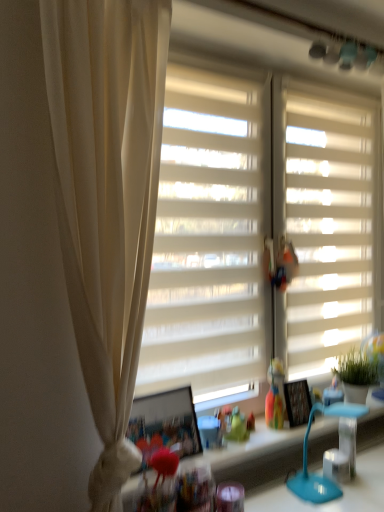
Question: From the image's perspective, is white matte window screen at center beneath translucent plastic toy at center?

Choices:
 (A) yes
 (B) no

Answer: (B)

Question: Can you confirm if white matte window screen at center is taller than translucent plastic toy at center?

Choices:
 (A) yes
 (B) no

Answer: (A)

Question: Is white matte window screen at center to the right of translucent plastic toy at center from the viewer's perspective?

Choices:
 (A) no
 (B) yes

Answer: (A)

Question: Can you confirm if white matte window screen at center is positioned to the left of translucent plastic toy at center?

Choices:
 (A) yes
 (B) no

Answer: (A)

Question: Is white matte window screen at center facing towards translucent plastic toy at center?

Choices:
 (A) yes
 (B) no

Answer: (A)

Question: From the image's perspective, is matte blue table lamp at lower right positioned above or below white matte window blind at right?

Choices:
 (A) above
 (B) below

Answer: (B)

Question: Considering the positions of point (306, 498) and point (362, 211), is point (306, 498) closer or farther from the camera than point (362, 211)?

Choices:
 (A) closer
 (B) farther

Answer: (A)

Question: In terms of size, does matte blue table lamp at lower right appear bigger or smaller than white matte window blind at right?

Choices:
 (A) small
 (B) big

Answer: (A)

Question: In the image, is matte blue table lamp at lower right positioned in front of or behind white matte window blind at right?

Choices:
 (A) front
 (B) behind

Answer: (A)

Question: In the image, is white matte window blind at right positioned in front of or behind matte blue table lamp at lower right?

Choices:
 (A) front
 (B) behind

Answer: (B)

Question: From a real-world perspective, is white matte window blind at right positioned above or below matte blue table lamp at lower right?

Choices:
 (A) below
 (B) above

Answer: (B)

Question: Based on their positions, is white matte window blind at right located to the left or right of matte blue table lamp at lower right?

Choices:
 (A) left
 (B) right

Answer: (B)

Question: From the image's perspective, is white matte window blind at right positioned above or below matte blue table lamp at lower right?

Choices:
 (A) above
 (B) below

Answer: (A)

Question: Would you say translucent plastic toy at center is inside or outside matte blue table lamp at lower right?

Choices:
 (A) outside
 (B) inside

Answer: (A)

Question: Considering the positions of translucent plastic toy at center and matte blue table lamp at lower right in the image, is translucent plastic toy at center bigger or smaller than matte blue table lamp at lower right?

Choices:
 (A) small
 (B) big

Answer: (A)